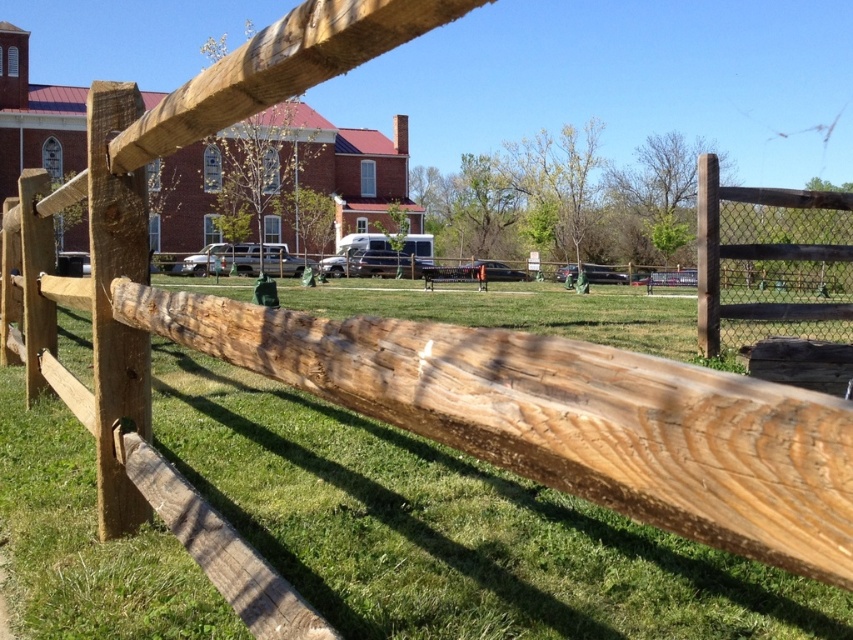
Which is in front, point (74, 593) or point (701, 246)?

Point (74, 593)

Can you confirm if green grass at center is shorter than brown wooden fence at right?

Yes.

Find the location of a particular element. The width and height of the screenshot is (853, 640). green grass at center is located at coordinates (447, 529).